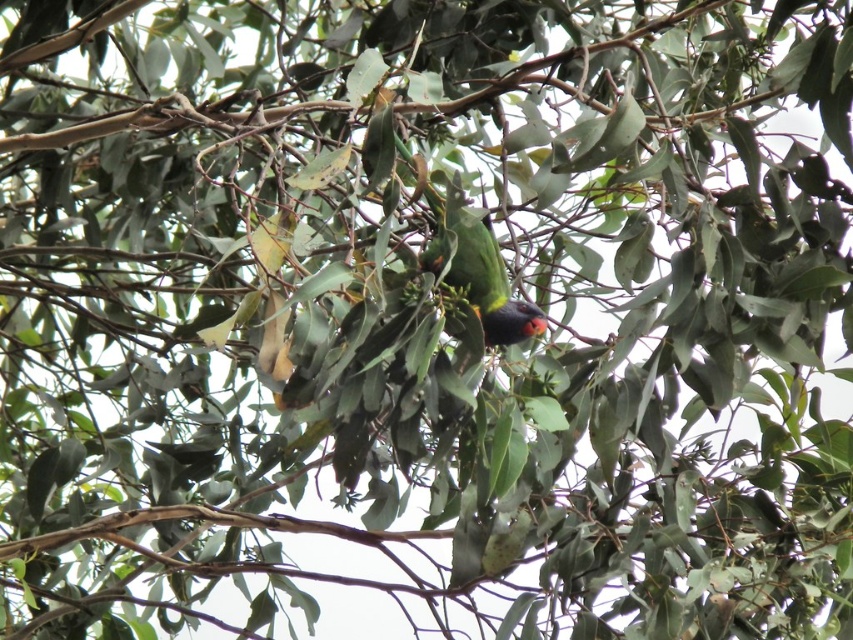
Who is lower down, green leafy branch at center or multicolored glossy parrot at center?

Positioned lower is multicolored glossy parrot at center.

Who is positioned more to the right, green leafy branch at center or multicolored glossy parrot at center?

From the viewer's perspective, multicolored glossy parrot at center appears more on the right side.

Does point (540, 60) come in front of point (500, 276)?

Yes.

The height and width of the screenshot is (640, 853). What are the coordinates of `green leafy branch at center` in the screenshot? It's located at (128, 124).